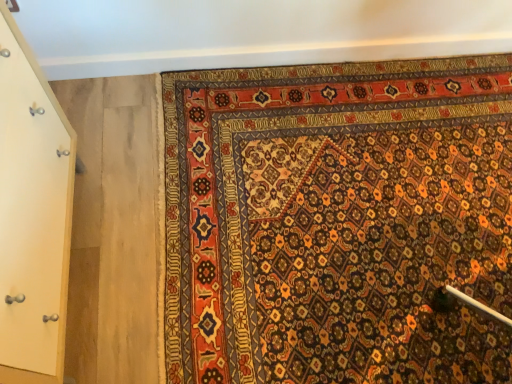
This screenshot has height=384, width=512. What are the coordinates of `free point below carpet with intricate patterns at lower right (from a real-world perspective)` in the screenshot? It's located at (353, 180).